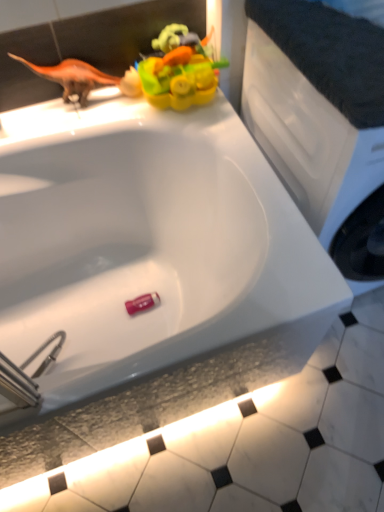
Question: Can you confirm if white glossy tile at lower center is shorter than white matte counter top at upper right?

Choices:
 (A) no
 (B) yes

Answer: (B)

Question: From the image's perspective, is white glossy tile at lower center located beneath white matte counter top at upper right?

Choices:
 (A) yes
 (B) no

Answer: (A)

Question: Would you consider white glossy tile at lower center to be distant from white matte counter top at upper right?

Choices:
 (A) no
 (B) yes

Answer: (A)

Question: Considering the relative positions of white glossy tile at lower center and white matte counter top at upper right in the image provided, is white glossy tile at lower center to the right of white matte counter top at upper right from the viewer's perspective?

Choices:
 (A) yes
 (B) no

Answer: (B)

Question: Is white glossy tile at lower center positioned beyond the bounds of white matte counter top at upper right?

Choices:
 (A) yes
 (B) no

Answer: (A)

Question: Does white glossy tile at lower center lie behind white matte counter top at upper right?

Choices:
 (A) yes
 (B) no

Answer: (A)

Question: Is pink plastic eraser at bottom, the 1th toy when ordered from back to front, far away from orange matte dinosaur at upper left?

Choices:
 (A) yes
 (B) no

Answer: (B)

Question: Considering the relative sizes of pink plastic eraser at bottom, acting as the second toy starting from the top, and orange matte dinosaur at upper left in the image provided, is pink plastic eraser at bottom, acting as the second toy starting from the top, bigger than orange matte dinosaur at upper left?

Choices:
 (A) yes
 (B) no

Answer: (B)

Question: Is pink plastic eraser at bottom, acting as the second toy starting from the top, smaller than orange matte dinosaur at upper left?

Choices:
 (A) yes
 (B) no

Answer: (A)

Question: From a real-world perspective, is pink plastic eraser at bottom, which ranks as the 2th toy in front-to-back order, located beneath orange matte dinosaur at upper left?

Choices:
 (A) no
 (B) yes

Answer: (B)

Question: Is pink plastic eraser at bottom, the 1th toy when ordered from back to front, touching orange matte dinosaur at upper left?

Choices:
 (A) no
 (B) yes

Answer: (A)

Question: Does pink plastic eraser at bottom, which ranks as the 2th toy in front-to-back order, turn towards orange matte dinosaur at upper left?

Choices:
 (A) no
 (B) yes

Answer: (A)

Question: Is pink plastic eraser at bottom, which appears as the 1th toy when ordered from the bottom, further to the viewer compared to white matte counter top at upper right?

Choices:
 (A) yes
 (B) no

Answer: (A)